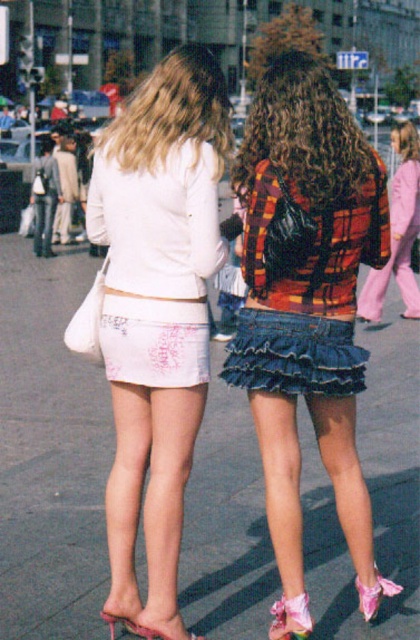
Question: Which object appears farthest from the camera in this image?

Choices:
 (A) white matte skirt at center
 (B) pink suede sandal at lower center
 (C) denim frill skirt at center
 (D) pink satin heel at lower right

Answer: (D)

Question: Which of the following is the closest to the observer?

Choices:
 (A) pink satin sandal at lower right
 (B) blonde hair at upper center
 (C) white cotton skirt at center

Answer: (A)

Question: Is white fabric skirt at center behind white matte skirt at center?

Choices:
 (A) no
 (B) yes

Answer: (B)

Question: Can you confirm if denim skirt at center is positioned to the right of white matte skirt at center?

Choices:
 (A) no
 (B) yes

Answer: (B)

Question: Which object is the closest to the ruffled denim skirt at center?

Choices:
 (A) pink suede sandal at lower center
 (B) white fabric skirt at center

Answer: (A)

Question: Does denim skirt at center have a larger size compared to denim frill skirt at center?

Choices:
 (A) yes
 (B) no

Answer: (A)